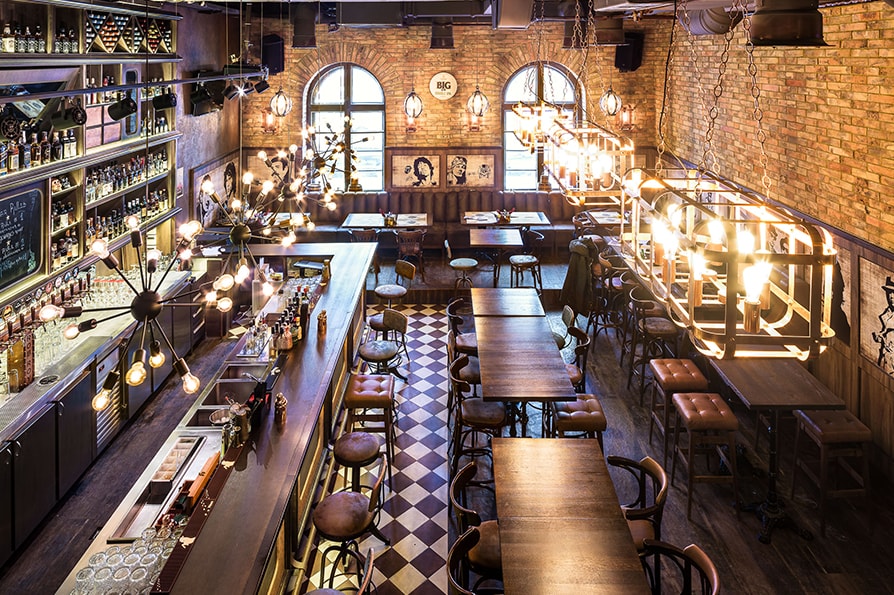
Locate an element on the screen. The width and height of the screenshot is (894, 595). wall light fixtures is located at coordinates (282, 107), (409, 105), (484, 103), (619, 97).